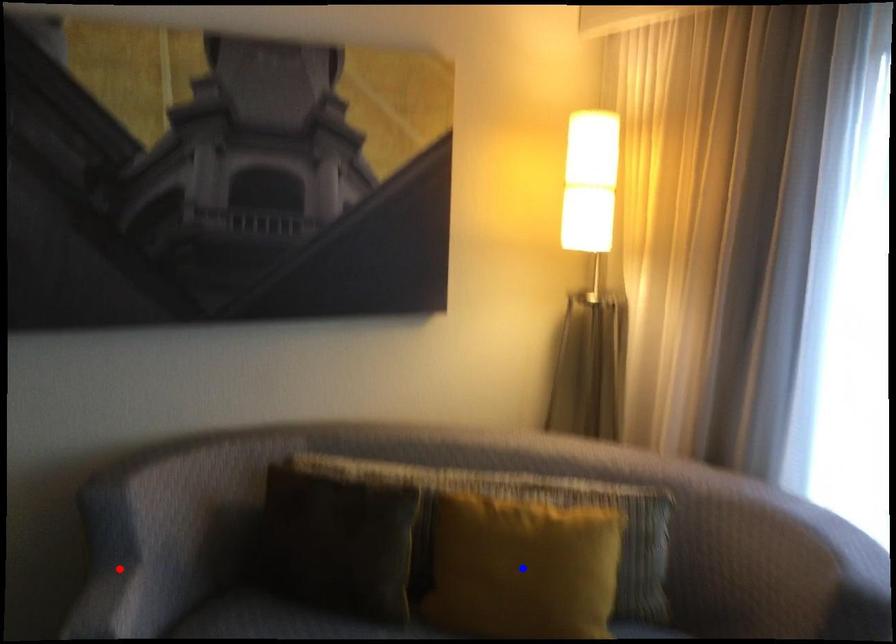
Question: Two points are marked on the image. Which point is closer to the camera?

Choices:
 (A) Blue point is closer.
 (B) Red point is closer.

Answer: (A)